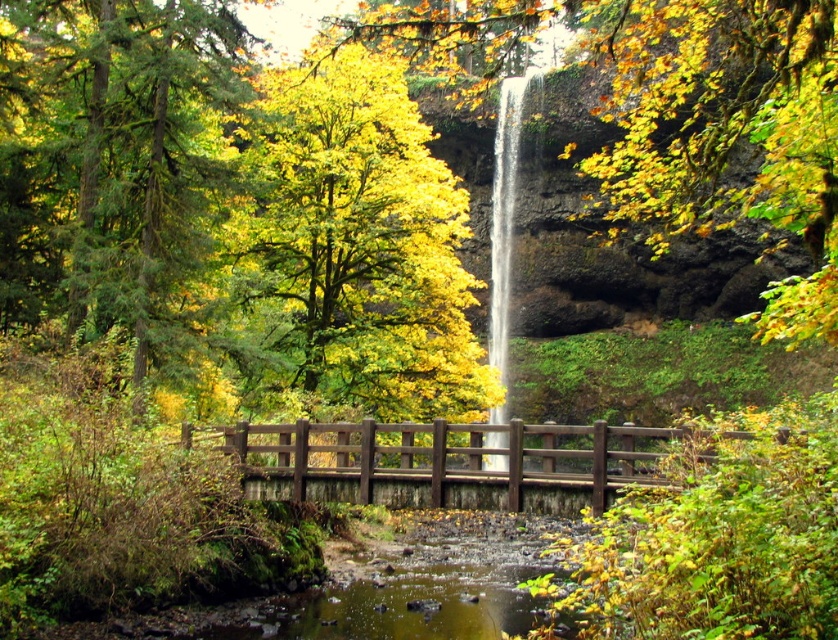
Can you confirm if yellow/golden leaves at center is positioned above white smooth waterfall at center?

Indeed, yellow/golden leaves at center is positioned over white smooth waterfall at center.

Is yellow/golden leaves at center positioned in front of white smooth waterfall at center?

No, it is not.

Describe the element at coordinates (355, 244) in the screenshot. I see `yellow/golden leaves at center` at that location.

The height and width of the screenshot is (640, 838). What are the coordinates of `yellow/golden leaves at center` in the screenshot? It's located at (355, 244).

Can you confirm if brown wooden bridge at center is smaller than white smooth waterfall at center?

Correct, brown wooden bridge at center occupies less space than white smooth waterfall at center.

Between brown wooden bridge at center and white smooth waterfall at center, which one is positioned higher?

Positioned higher is white smooth waterfall at center.

At what (x,y) coordinates should I click in order to perform the action: click on brown wooden bridge at center. Please return your answer as a coordinate pair (x, y). The width and height of the screenshot is (838, 640). Looking at the image, I should click on (451, 461).

Is yellow leafy tree at center positioned before white smooth waterfall at center?

Yes, it is in front of white smooth waterfall at center.

Can you confirm if yellow leafy tree at center is shorter than white smooth waterfall at center?

No.

You are a GUI agent. You are given a task and a screenshot of the screen. Output one action in this format:
    pyautogui.click(x=<x>, y=<y>)
    Task: Click on the yellow leafy tree at center
    
    Given the screenshot: What is the action you would take?
    point(676,115)

Where is `yellow leafy tree at center`? The image size is (838, 640). yellow leafy tree at center is located at coordinates (676, 115).